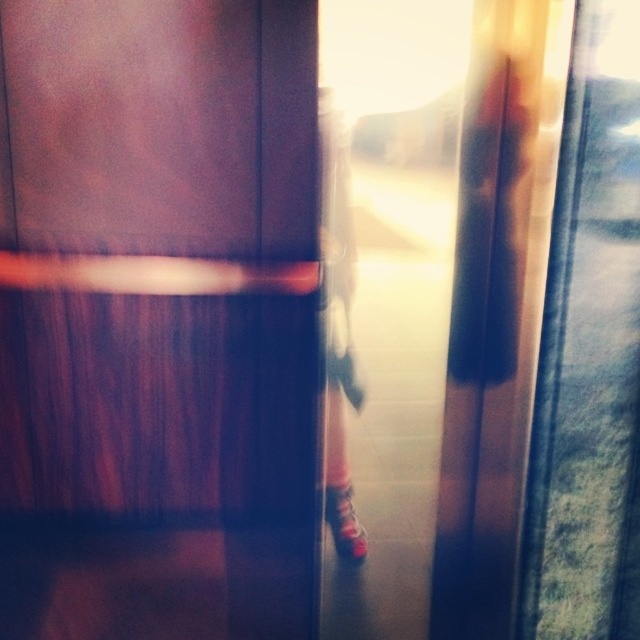
Question: Which object is farther from the camera taking this photo?

Choices:
 (A) pink fabric dress at center
 (B) wooden elevator door at center
 (C) shiny red shoe at center

Answer: (C)

Question: Does wooden elevator door at center lie behind pink fabric dress at center?

Choices:
 (A) no
 (B) yes

Answer: (A)

Question: Which point is farther to the camera?

Choices:
 (A) (358, 548)
 (B) (284, 300)

Answer: (A)

Question: Is wooden elevator door at center bigger than shiny red shoe at center?

Choices:
 (A) no
 (B) yes

Answer: (B)

Question: Considering the real-world distances, which object is closest to the wooden elevator door at center?

Choices:
 (A) shiny red shoe at center
 (B) pink fabric dress at center

Answer: (B)

Question: Does pink fabric dress at center have a smaller size compared to shiny red shoe at center?

Choices:
 (A) yes
 (B) no

Answer: (B)